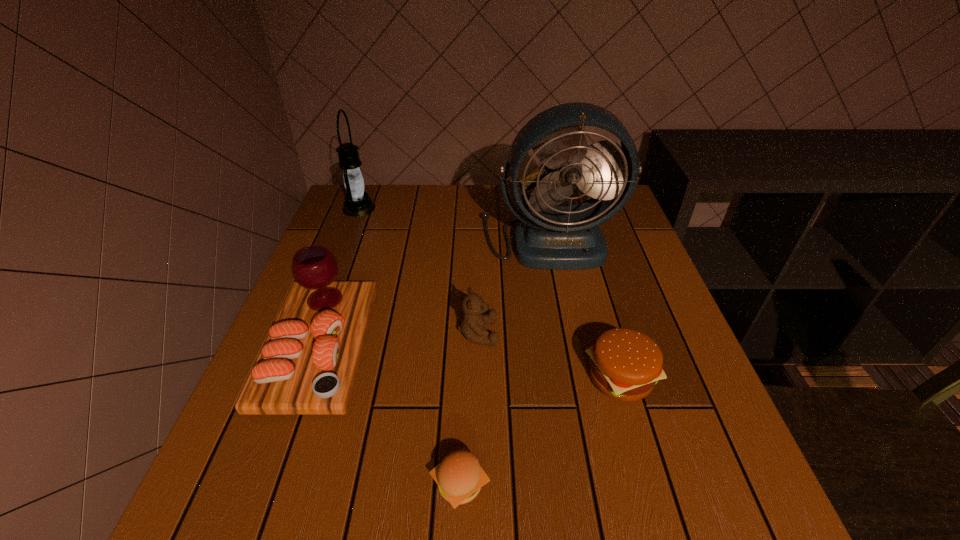
The width and height of the screenshot is (960, 540). I want to click on vacant space in between the fourth tallest object and the fourth shortest object, so click(x=398, y=341).

This screenshot has width=960, height=540. Find the location of `unoccupied position between the platter and the tallest object`. unoccupied position between the platter and the tallest object is located at coordinates (434, 293).

Locate an element on the screen. This screenshot has width=960, height=540. empty space between the second shortest object and the fourth shortest object is located at coordinates (470, 362).

Where is `vacant area between the platter and the lantern`? vacant area between the platter and the lantern is located at coordinates (340, 278).

I want to click on empty space between the shorter hamburger and the fan, so coord(504,361).

Image resolution: width=960 pixels, height=540 pixels. In order to click on free spot between the third tallest object and the lantern in this screenshot , I will do `click(340, 278)`.

Locate an element on the screen. Image resolution: width=960 pixels, height=540 pixels. free space between the fan and the platter is located at coordinates (434, 293).

Identify the location of free spot between the right hamburger and the tallest object. The width and height of the screenshot is (960, 540). (585, 308).

This screenshot has height=540, width=960. In order to click on the second closest object to the taller hamburger in this screenshot , I will do `click(459, 477)`.

Identify the location of object that can be found as the closest to the fan. (473, 323).